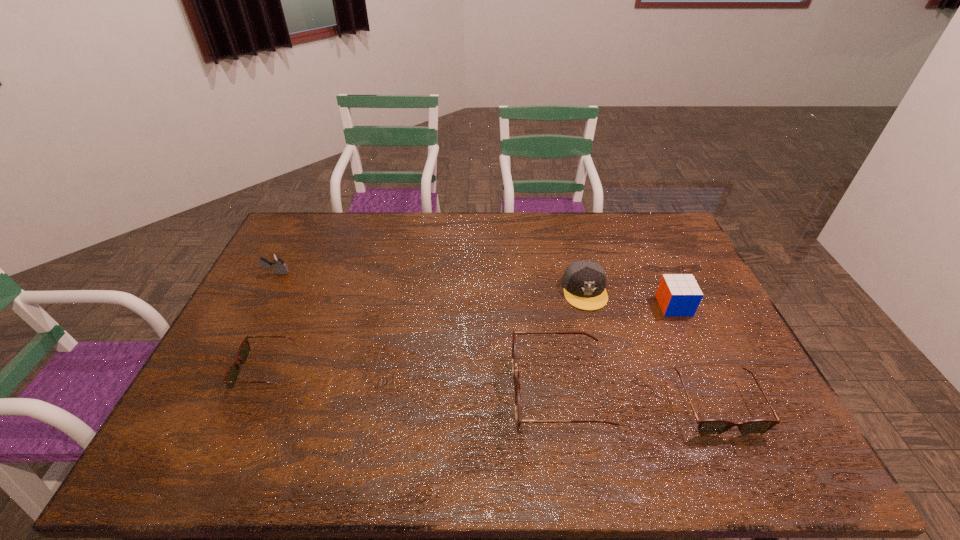
Locate an element on the screen. This screenshot has height=540, width=960. the leftmost spectacles is located at coordinates (232, 374).

Locate an element on the screen. This screenshot has height=540, width=960. the shortest spectacles is located at coordinates (232, 374).

Identify the location of the tallest spectacles. This screenshot has height=540, width=960. (519, 420).

Identify the location of the rightmost spectacles. (710, 427).

Find the location of a particular element. the second shortest spectacles is located at coordinates (710, 427).

You are a GUI agent. You are given a task and a screenshot of the screen. Output one action in this format:
    pyautogui.click(x=<x>, y=<y>)
    Task: Click on the igniter
    The width and height of the screenshot is (960, 540).
    Given the screenshot: What is the action you would take?
    pyautogui.click(x=277, y=262)

Identify the location of cap. The image size is (960, 540). (584, 281).

The height and width of the screenshot is (540, 960). Identify the location of cube. (678, 294).

This screenshot has width=960, height=540. What are the coordinates of `free location located 0.090m at the front view of the shortest object` in the screenshot? It's located at (208, 369).

I want to click on free space located 0.080m at the front view of the tallest spectacles, so click(483, 393).